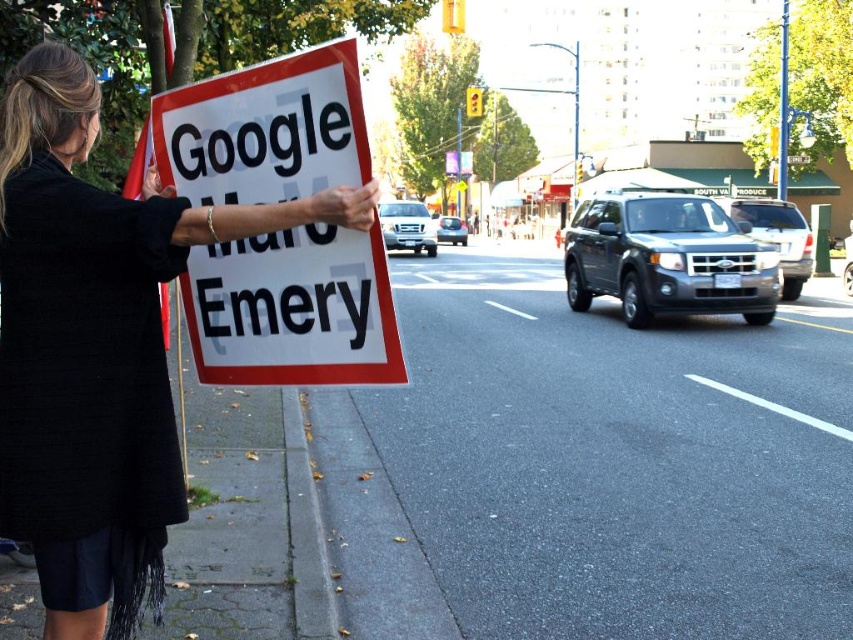
Does black fabric dress at left have a greater width compared to white paper sign at left?

Indeed, black fabric dress at left has a greater width compared to white paper sign at left.

Which is in front, point (68, 538) or point (364, 369)?

Point (68, 538) is more forward.

Which is in front, point (146, 218) or point (323, 371)?

Point (146, 218) is more forward.

Find the location of a particular element. The height and width of the screenshot is (640, 853). black fabric dress at left is located at coordinates (97, 348).